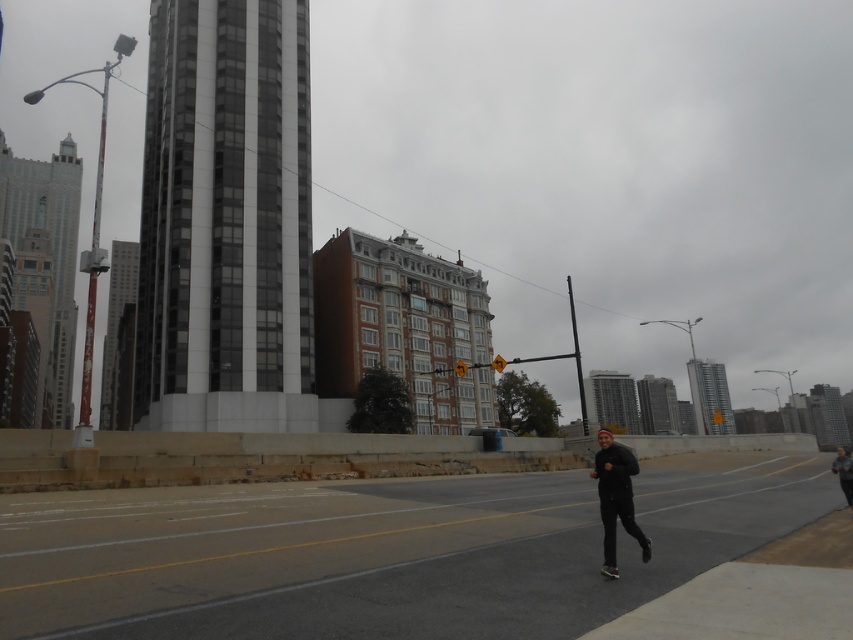
Question: Observing the image, what is the correct spatial positioning of glassy reflective building at upper right in reference to multicolored rubber skateboard at lower right?

Choices:
 (A) left
 (B) right

Answer: (B)

Question: Considering the real-world distances, which object is closest to the black asphalt highway at center?

Choices:
 (A) white glass skyscraper at upper left
 (B) glassy reflective building at upper right
 (C) dark gray concrete building at upper right
 (D) black matte jacket at right

Answer: (D)

Question: Which point appears farthest from the camera in this image?

Choices:
 (A) (827, 404)
 (B) (608, 483)
 (C) (111, 284)

Answer: (C)

Question: Among these points, which one is nearest to the camera?

Choices:
 (A) (833, 400)
 (B) (604, 563)
 (C) (103, 339)

Answer: (B)

Question: Does black asphalt highway at center have a smaller size compared to glassy gray skyscraper at upper right?

Choices:
 (A) no
 (B) yes

Answer: (B)

Question: In this image, where is white glass skyscraper at upper left located relative to metallic silver tower at left?

Choices:
 (A) left
 (B) right

Answer: (A)